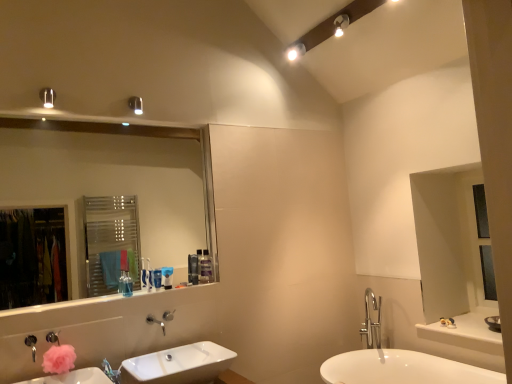
Question: Is point (296, 44) closer or farther from the camera than point (148, 281)?

Choices:
 (A) farther
 (B) closer

Answer: (A)

Question: Is white glossy spot light at upper center, the 2th light fixture in the right-to-left sequence, to the left or to the right of translucent plastic toothbrush at center, acting as the 5th toiletry starting from the back, in the image?

Choices:
 (A) right
 (B) left

Answer: (A)

Question: Which of these objects is positioned closest to the matte silver light fixture at upper left, the first light fixture when ordered from front to back?

Choices:
 (A) white glossy sink at lower center, which appears as the 2th sink when viewed from the left
 (B) blue matte toothpaste tube at center, positioned as the fourth toiletry in right-to-left order
 (C) translucent plastic toothbrush at center, which is counted as the 5th toiletry, starting from the right
 (D) pink fluffy flower at lower left
 (E) white glossy spot light at upper center, the third light fixture in the left-to-right sequence

Answer: (B)

Question: Based on their relative distances, which object is farther from the metallic cylindrical light fixture at upper left, the 2th light fixture in the bottom-to-top sequence?

Choices:
 (A) white glossy spot light at upper center, positioned as the 2th light fixture in top-to-bottom order
 (B) satin black soap dispenser at upper center, acting as the 2th toiletry starting from the right
 (C) matte white light fixture at upper center, the 2th light fixture positioned from the back
 (D) clear glass mirror at upper left
 (E) blue plastic toothbrush at upper center, positioned as the third toiletry in front-to-back order

Answer: (D)